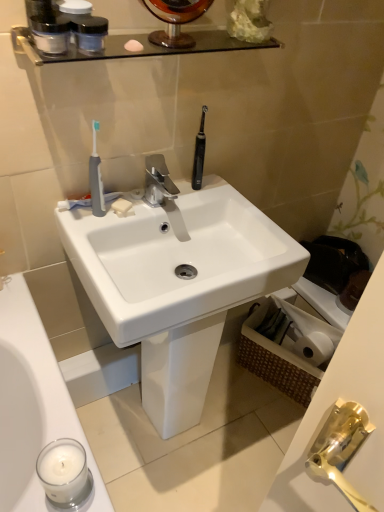
Question: Considering the relative positions of white glossy sink at center and matte black jars at upper left in the image provided, is white glossy sink at center behind matte black jars at upper left?

Choices:
 (A) yes
 (B) no

Answer: (A)

Question: From the image's perspective, is white glossy sink at center on top of matte black jars at upper left?

Choices:
 (A) no
 (B) yes

Answer: (A)

Question: Is matte black jars at upper left located within white glossy sink at center?

Choices:
 (A) no
 (B) yes

Answer: (A)

Question: Is white glossy sink at center oriented towards matte black jars at upper left?

Choices:
 (A) no
 (B) yes

Answer: (A)

Question: Can you confirm if white glossy sink at center is bigger than matte black jars at upper left?

Choices:
 (A) yes
 (B) no

Answer: (A)

Question: From the image's perspective, is transparent plastic mouthwash at upper center, marked as the first mouthwash in a right-to-left arrangement, located above or below gray rubber toothbrush at left?

Choices:
 (A) below
 (B) above

Answer: (B)

Question: Is transparent plastic mouthwash at upper center, the 2th mouthwash in the left-to-right sequence, wider or thinner than gray rubber toothbrush at left?

Choices:
 (A) wide
 (B) thin

Answer: (A)

Question: Is point (86, 36) positioned closer to the camera than point (97, 193)?

Choices:
 (A) closer
 (B) farther

Answer: (A)

Question: Choose the correct answer: Is transparent plastic mouthwash at upper center, marked as the first mouthwash in a right-to-left arrangement, inside gray rubber toothbrush at left or outside it?

Choices:
 (A) outside
 (B) inside

Answer: (A)

Question: Considering the positions of white glossy sink at center and polished chrome faucet at center in the image, is white glossy sink at center wider or thinner than polished chrome faucet at center?

Choices:
 (A) wide
 (B) thin

Answer: (A)

Question: Considering the positions of white glossy sink at center and polished chrome faucet at center in the image, is white glossy sink at center bigger or smaller than polished chrome faucet at center?

Choices:
 (A) small
 (B) big

Answer: (B)

Question: Is point (248, 282) closer or farther from the camera than point (155, 186)?

Choices:
 (A) farther
 (B) closer

Answer: (B)

Question: Is white glossy sink at center in front of or behind polished chrome faucet at center in the image?

Choices:
 (A) behind
 (B) front

Answer: (B)

Question: Based on their positions, is gray rubber toothbrush at left located to the left or right of translucent plastic containers at upper left, which is counted as the first mouthwash, starting from the left?

Choices:
 (A) right
 (B) left

Answer: (A)

Question: Considering the positions of point (97, 178) and point (34, 19), is point (97, 178) closer or farther from the camera than point (34, 19)?

Choices:
 (A) closer
 (B) farther

Answer: (B)